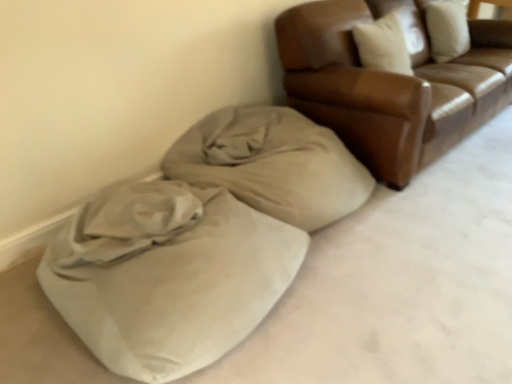
Question: Should I look upward or downward to see brown leather couch at upper right?

Choices:
 (A) down
 (B) up

Answer: (B)

Question: Is beige fabric blanket at lower left far away from suede-like beige bean bag at lower left?

Choices:
 (A) yes
 (B) no

Answer: (B)

Question: Does beige fabric blanket at lower left have a larger size compared to suede-like beige bean bag at lower left?

Choices:
 (A) no
 (B) yes

Answer: (A)

Question: Is beige fabric blanket at lower left completely or partially outside of suede-like beige bean bag at lower left?

Choices:
 (A) yes
 (B) no

Answer: (A)

Question: Can you confirm if beige fabric blanket at lower left is smaller than suede-like beige bean bag at lower left?

Choices:
 (A) no
 (B) yes

Answer: (B)

Question: Is beige fabric blanket at lower left facing towards suede-like beige bean bag at lower left?

Choices:
 (A) yes
 (B) no

Answer: (B)

Question: From the image's perspective, would you say beige fabric blanket at lower left is positioned over suede-like beige bean bag at lower left?

Choices:
 (A) no
 (B) yes

Answer: (B)

Question: Does brown leather couch at upper right have a larger size compared to beige fabric blanket at lower left?

Choices:
 (A) yes
 (B) no

Answer: (A)

Question: Does brown leather couch at upper right lie in front of beige fabric blanket at lower left?

Choices:
 (A) yes
 (B) no

Answer: (B)

Question: Can you confirm if brown leather couch at upper right is positioned to the right of beige fabric blanket at lower left?

Choices:
 (A) no
 (B) yes

Answer: (B)

Question: From a real-world perspective, is brown leather couch at upper right under beige fabric blanket at lower left?

Choices:
 (A) no
 (B) yes

Answer: (A)

Question: Would you say brown leather couch at upper right is a long distance from beige fabric blanket at lower left?

Choices:
 (A) no
 (B) yes

Answer: (A)

Question: Are brown leather couch at upper right and beige fabric blanket at lower left beside each other?

Choices:
 (A) no
 (B) yes

Answer: (A)

Question: Does brown leather couch at upper right have a smaller size compared to suede-like beige bean bag at lower left?

Choices:
 (A) yes
 (B) no

Answer: (B)